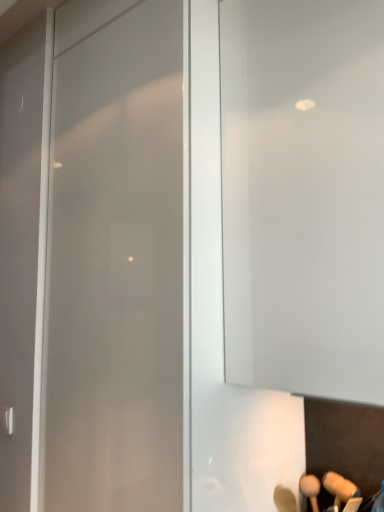
Question: Would you say satin silver handle at lower left is to the left or to the right of transparent glass door at center in the picture?

Choices:
 (A) left
 (B) right

Answer: (A)

Question: In terms of width, does satin silver handle at lower left look wider or thinner when compared to transparent glass door at center?

Choices:
 (A) thin
 (B) wide

Answer: (A)

Question: Is satin silver handle at lower left inside the boundaries of transparent glass door at center, or outside?

Choices:
 (A) outside
 (B) inside

Answer: (A)

Question: Is point (178, 401) closer or farther from the camera than point (9, 423)?

Choices:
 (A) farther
 (B) closer

Answer: (B)

Question: Relative to satin silver handle at lower left, is transparent glass door at center in front or behind?

Choices:
 (A) front
 (B) behind

Answer: (A)

Question: From the image's perspective, is transparent glass door at center positioned above or below satin silver handle at lower left?

Choices:
 (A) above
 (B) below

Answer: (A)

Question: From a real-world perspective, relative to satin silver handle at lower left, is transparent glass door at center vertically above or below?

Choices:
 (A) above
 (B) below

Answer: (A)